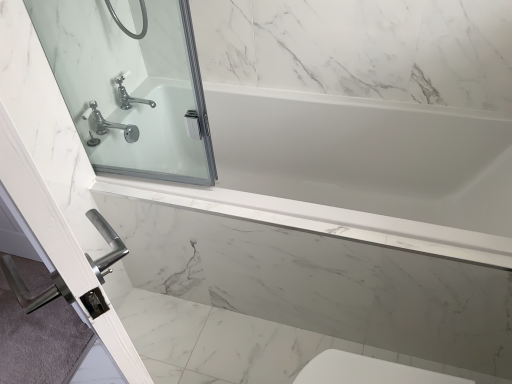
Question: In terms of height, does white glossy bathtub at center look taller or shorter compared to clear glass door at upper left?

Choices:
 (A) tall
 (B) short

Answer: (B)

Question: From a real-world perspective, is white glossy bathtub at center above or below clear glass door at upper left?

Choices:
 (A) below
 (B) above

Answer: (A)

Question: Which object is the farthest from the chrome metallic faucet at upper left?

Choices:
 (A) clear glass shower door at upper left
 (B) white glossy bathtub at center
 (C) clear glass door at upper left

Answer: (B)

Question: Estimate the real-world distances between objects in this image. Which object is closer to the white glossy bathtub at center?

Choices:
 (A) chrome metallic faucet at upper left
 (B) clear glass door at upper left
 (C) clear glass shower door at upper left

Answer: (C)